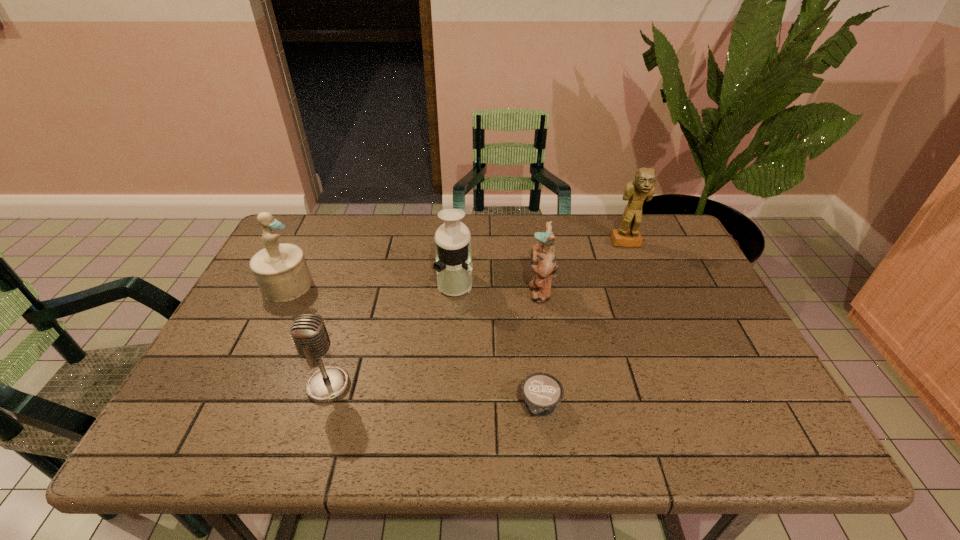
At what (x,y) coordinates should I click in order to perform the action: click on vacant space at the far edge of the desktop. Please return your answer as a coordinate pair (x, y). Looking at the image, I should click on (417, 233).

Find the location of a particular element. free space at the near edge of the desktop is located at coordinates (695, 427).

Locate an element on the screen. This screenshot has width=960, height=540. free space at the left edge is located at coordinates (185, 396).

The width and height of the screenshot is (960, 540). In the image, there is a desktop. Identify the location of free region at the right edge. (692, 303).

In order to click on free space at the far left corner in this screenshot , I will do `click(327, 229)`.

Locate an element on the screen. The width and height of the screenshot is (960, 540). free space at the near left corner is located at coordinates (237, 450).

Locate an element on the screen. The width and height of the screenshot is (960, 540). vacant space at the far right corner of the desktop is located at coordinates [x=655, y=241].

Locate an element on the screen. free spot between the leftmost object and the juicer is located at coordinates (371, 284).

You are a GUI agent. You are given a task and a screenshot of the screen. Output one action in this format:
    pyautogui.click(x=<x>, y=<y>)
    Task: Click on the free space between the rightmost object and the shortest object
    
    Given the screenshot: What is the action you would take?
    pyautogui.click(x=584, y=325)

Find the location of a particular element. This screenshot has width=960, height=540. free space between the juicer and the leftmost figurine is located at coordinates (371, 284).